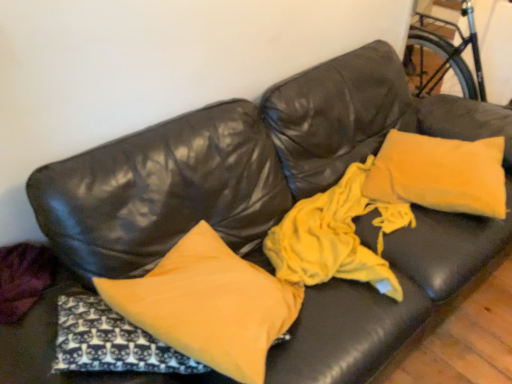
Question: Based on their positions, is matte yellow pillow at center, which is the 1th pillow from left to right, located to the left or right of yellow soft pillow at upper right, which appears as the second pillow when viewed from the front?

Choices:
 (A) right
 (B) left

Answer: (B)

Question: In terms of size, does matte yellow pillow at center, arranged as the first pillow when viewed from the front, appear bigger or smaller than yellow soft pillow at upper right, which appears as the second pillow when viewed from the front?

Choices:
 (A) big
 (B) small

Answer: (A)

Question: Considering the positions of matte yellow pillow at center, the 2th pillow positioned from the right, and yellow soft pillow at upper right, which appears as the first pillow when viewed from the back, in the image, is matte yellow pillow at center, the 2th pillow positioned from the right, taller or shorter than yellow soft pillow at upper right, which appears as the first pillow when viewed from the back,?

Choices:
 (A) tall
 (B) short

Answer: (A)

Question: Looking at their shapes, would you say yellow soft pillow at upper right, which appears as the first pillow when viewed from the back, is wider or thinner than matte yellow pillow at center, which is the 1th pillow from left to right?

Choices:
 (A) thin
 (B) wide

Answer: (A)

Question: Does point (478, 183) appear closer or farther from the camera than point (273, 337)?

Choices:
 (A) farther
 (B) closer

Answer: (A)

Question: Based on their positions, is yellow soft pillow at upper right, which appears as the first pillow when viewed from the back, located to the left or right of matte yellow pillow at center, the 2th pillow positioned from the right?

Choices:
 (A) right
 (B) left

Answer: (A)

Question: Relative to matte yellow pillow at center, which is the 1th pillow from left to right, is yellow soft pillow at upper right, which appears as the first pillow when viewed from the back, in front or behind?

Choices:
 (A) behind
 (B) front

Answer: (A)